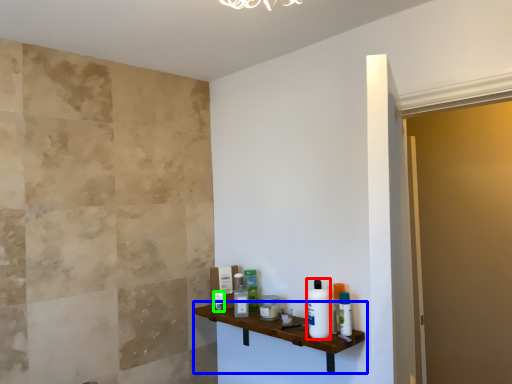
Question: Considering the real-world distances, which object is closest to toiletry (highlighted by a red box)? shelf (highlighted by a blue box) or toiletry (highlighted by a green box).

Choices:
 (A) shelf
 (B) toiletry

Answer: (A)